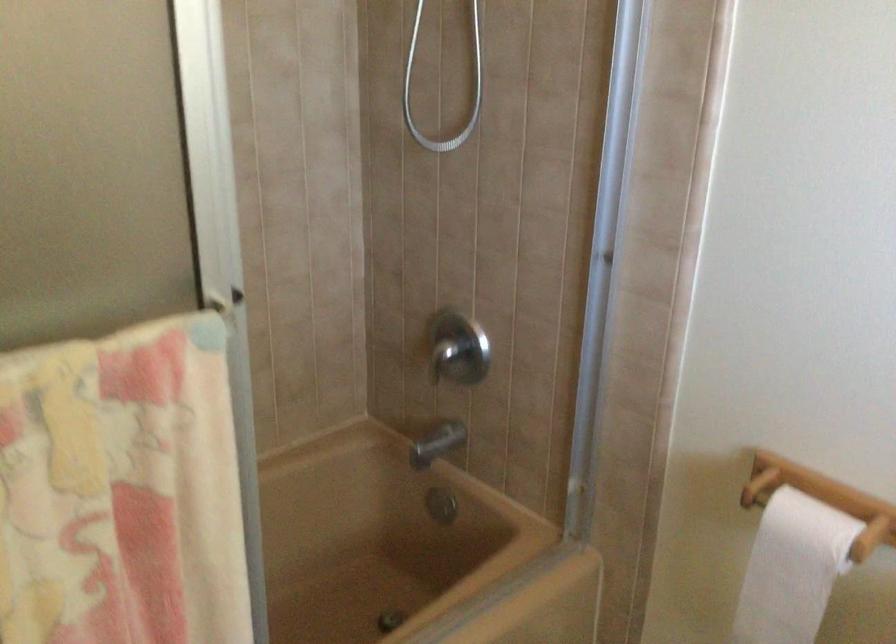
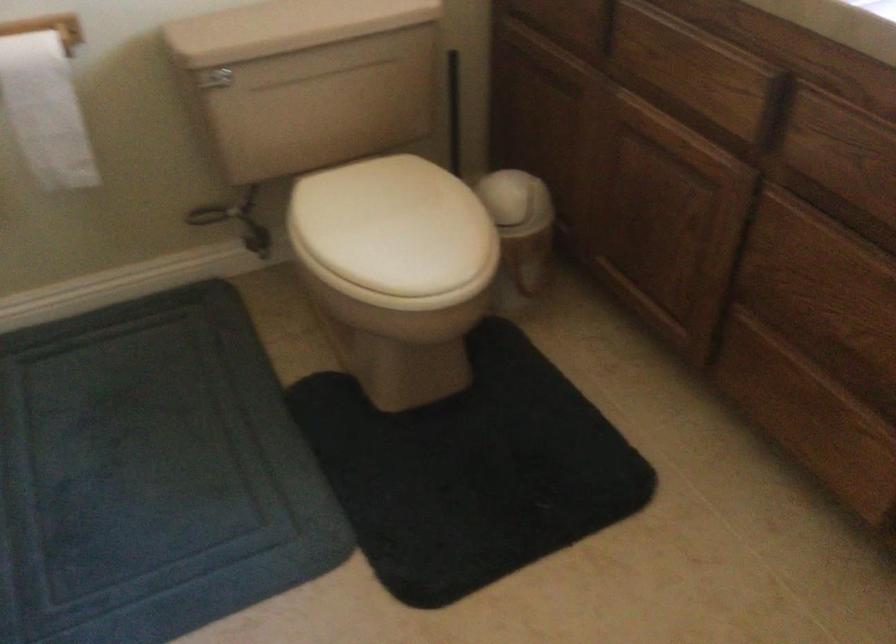
How did the camera likely rotate?

The camera's rotation is toward right-down.